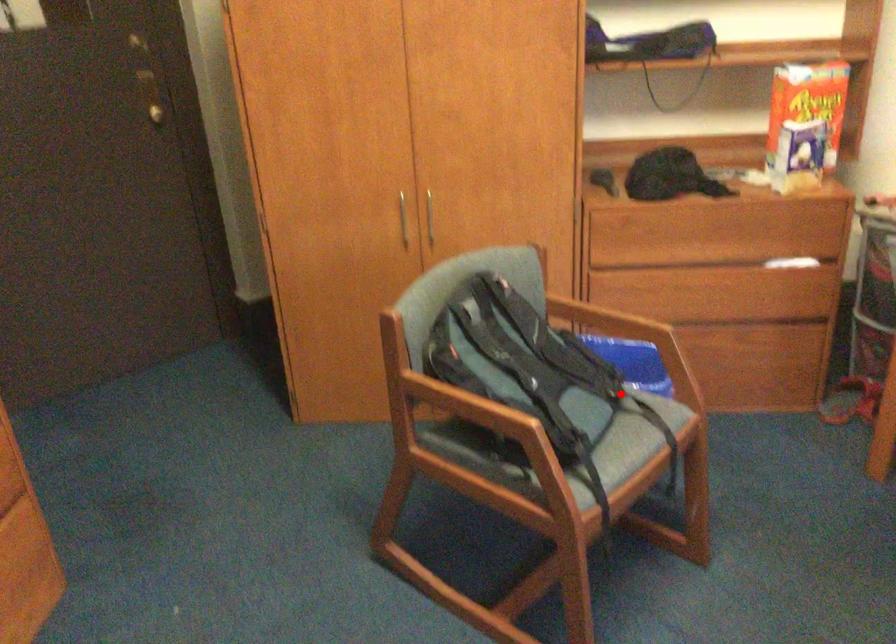
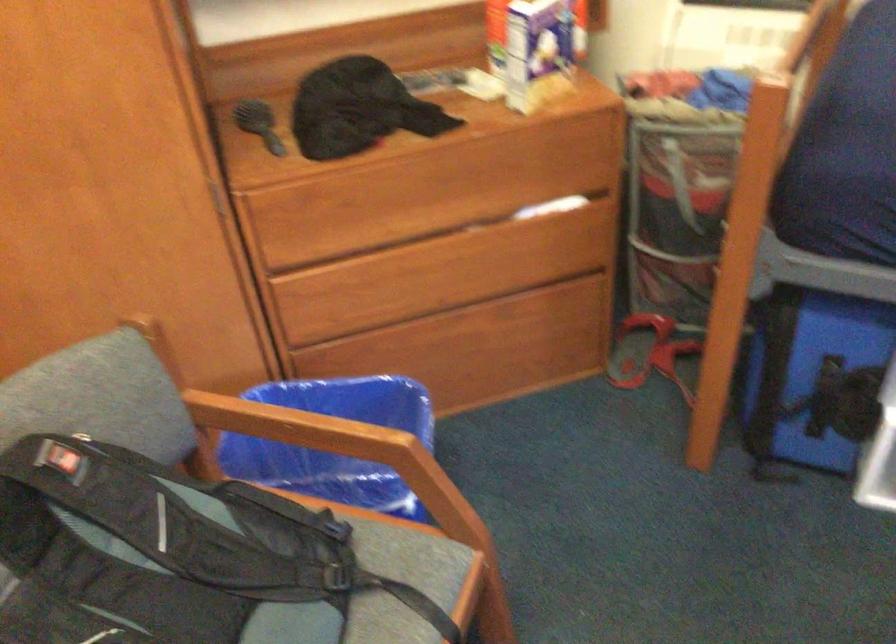
Where in the second image is the point corresponding to the highlighted location from the first image?

(352, 514)